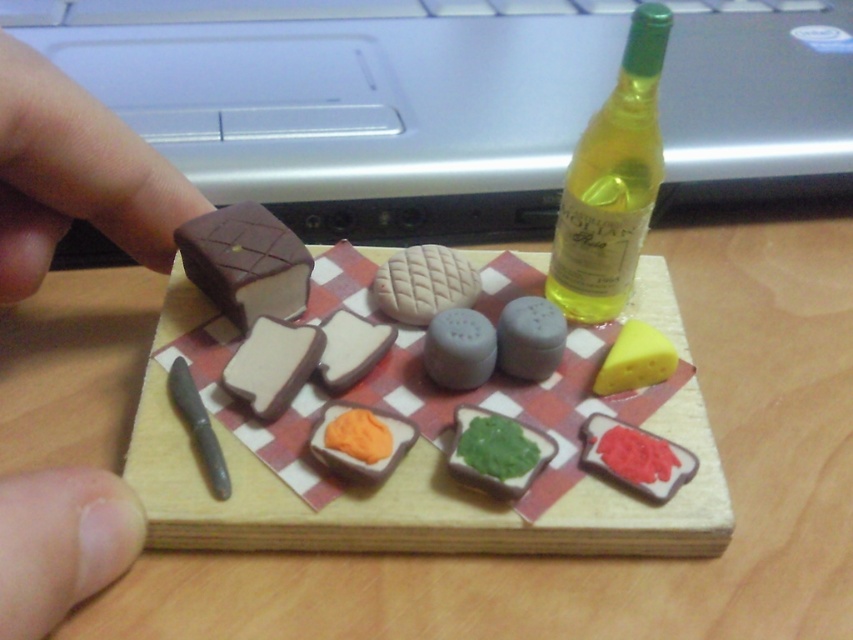
Between point (521, 426) and point (399, 253), which one is positioned in front?

Point (521, 426) is in front.

Is point (483, 426) positioned before point (453, 285)?

That is True.

Locate an element on the screen. Image resolution: width=853 pixels, height=640 pixels. green matte spread at center is located at coordinates (497, 451).

Can you confirm if dark brown chocolate at upper left is bigger than green glass bottle at upper right?

→ Correct, dark brown chocolate at upper left is larger in size than green glass bottle at upper right.

Which is behind, point (36, 113) or point (578, 177)?

Point (578, 177)

Where is `dark brown chocolate at upper left`? Image resolution: width=853 pixels, height=640 pixels. dark brown chocolate at upper left is located at coordinates (74, 173).

Is green matte spread at center behind gray matte salt shaker at center?

No, it is not.

Which is more to the left, green matte spread at center or gray matte salt shaker at center?

From the viewer's perspective, gray matte salt shaker at center appears more on the left side.

Does point (508, 497) come farther from viewer compared to point (465, 342)?

No.

This screenshot has width=853, height=640. In order to click on green matte spread at center in this screenshot , I will do `click(497, 451)`.